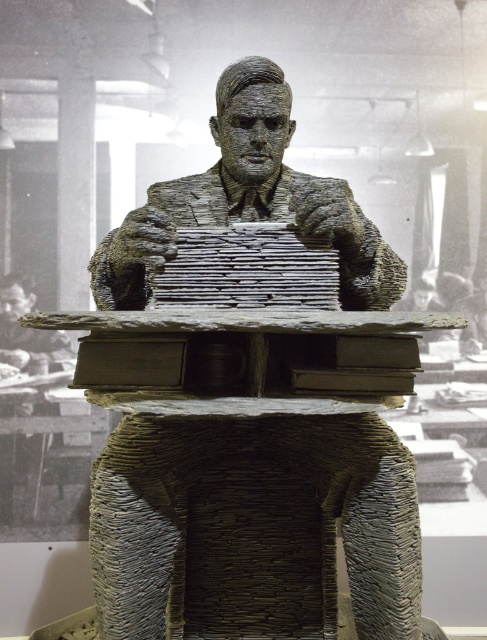
Question: Which point is farther to the camera?

Choices:
 (A) (151, 637)
 (B) (50, 337)

Answer: (B)

Question: Does rustic stone table at center appear on the right side of rustic stone statue at center?

Choices:
 (A) yes
 (B) no

Answer: (A)

Question: Which point appears closest to the camera in this image?

Choices:
 (A) (416, 316)
 (B) (32, 474)

Answer: (A)

Question: Which point appears closest to the camera in this image?

Choices:
 (A) [x=151, y=403]
 (B) [x=45, y=380]

Answer: (A)

Question: Where is rustic stone table at center located in relation to rustic stone statue at center in the image?

Choices:
 (A) below
 (B) above

Answer: (A)

Question: Can you confirm if rustic stone table at center is positioned to the right of rustic stone statue at center?

Choices:
 (A) yes
 (B) no

Answer: (A)